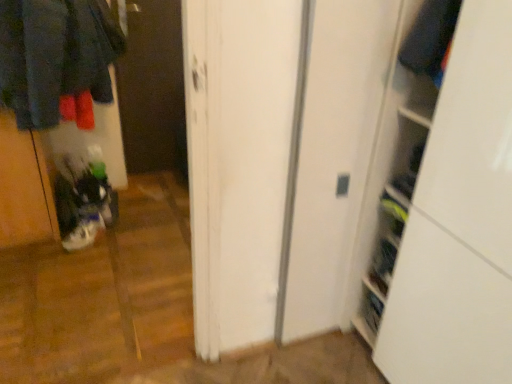
Question: Is dark wood screen door at center smaller than velvet-like dark blue sweater at upper right?

Choices:
 (A) yes
 (B) no

Answer: (B)

Question: Considering the relative sizes of dark wood screen door at center and velvet-like dark blue sweater at upper right in the image provided, is dark wood screen door at center wider than velvet-like dark blue sweater at upper right?

Choices:
 (A) yes
 (B) no

Answer: (B)

Question: Considering the relative positions of dark wood screen door at center and velvet-like dark blue sweater at upper right in the image provided, is dark wood screen door at center to the right of velvet-like dark blue sweater at upper right from the viewer's perspective?

Choices:
 (A) no
 (B) yes

Answer: (A)

Question: From a real-world perspective, does dark wood screen door at center sit lower than velvet-like dark blue sweater at upper right?

Choices:
 (A) no
 (B) yes

Answer: (B)

Question: From the image's perspective, does dark wood screen door at center appear higher than velvet-like dark blue sweater at upper right?

Choices:
 (A) no
 (B) yes

Answer: (B)

Question: From their relative heights in the image, would you say velvet-like dark blue sweater at upper right is taller or shorter than dark wood screen door at center?

Choices:
 (A) short
 (B) tall

Answer: (A)

Question: Considering the positions of point (432, 61) and point (169, 140), is point (432, 61) closer or farther from the camera than point (169, 140)?

Choices:
 (A) closer
 (B) farther

Answer: (A)

Question: Choose the correct answer: Is velvet-like dark blue sweater at upper right inside dark wood screen door at center or outside it?

Choices:
 (A) outside
 (B) inside

Answer: (A)

Question: Would you say velvet-like dark blue sweater at upper right is to the left or to the right of dark wood screen door at center in the picture?

Choices:
 (A) left
 (B) right

Answer: (B)

Question: Would you say white matte sneakers at lower left is inside or outside velvet-like dark blue sweater at upper right?

Choices:
 (A) outside
 (B) inside

Answer: (A)

Question: From the image's perspective, is white matte sneakers at lower left positioned above or below velvet-like dark blue sweater at upper right?

Choices:
 (A) above
 (B) below

Answer: (B)

Question: Considering their positions, is white matte sneakers at lower left located in front of or behind velvet-like dark blue sweater at upper right?

Choices:
 (A) behind
 (B) front

Answer: (A)

Question: In terms of size, does white matte sneakers at lower left appear bigger or smaller than velvet-like dark blue sweater at upper right?

Choices:
 (A) small
 (B) big

Answer: (B)

Question: From a real-world perspective, relative to white matte sneakers at lower left, is velvet-like dark blue sweater at upper right vertically above or below?

Choices:
 (A) above
 (B) below

Answer: (A)

Question: From the image's perspective, is velvet-like dark blue sweater at upper right positioned above or below white matte sneakers at lower left?

Choices:
 (A) above
 (B) below

Answer: (A)